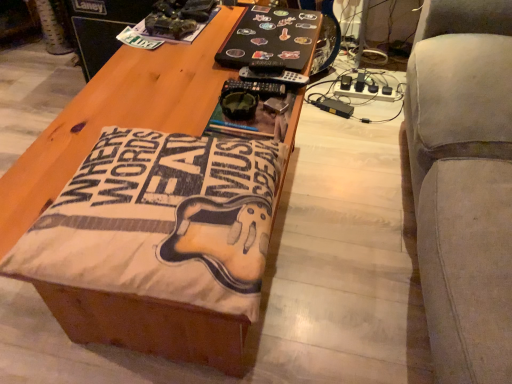
Question: Considering the positions of wooden table at center and beige fabric couch at right in the image, is wooden table at center bigger or smaller than beige fabric couch at right?

Choices:
 (A) small
 (B) big

Answer: (A)

Question: Is wooden table at center to the left or to the right of beige fabric couch at right in the image?

Choices:
 (A) left
 (B) right

Answer: (A)

Question: Is point (106, 340) closer or farther from the camera than point (501, 352)?

Choices:
 (A) farther
 (B) closer

Answer: (A)

Question: Looking at the image, does beige fabric couch at right seem bigger or smaller compared to wooden table at center?

Choices:
 (A) big
 (B) small

Answer: (A)

Question: Is beige fabric couch at right taller or shorter than wooden table at center?

Choices:
 (A) short
 (B) tall

Answer: (B)

Question: From the image's perspective, is beige fabric couch at right positioned above or below wooden table at center?

Choices:
 (A) below
 (B) above

Answer: (B)

Question: Is beige fabric couch at right inside the boundaries of wooden table at center, or outside?

Choices:
 (A) outside
 (B) inside

Answer: (A)